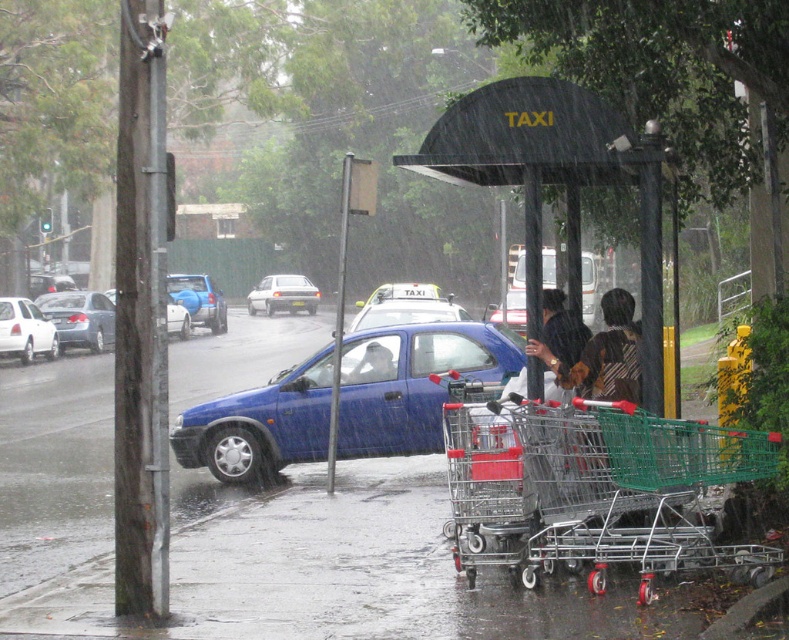
Can you confirm if metallic blue car at center is thinner than blue matte hatchback at center-left?

Correct, metallic blue car at center's width is less than blue matte hatchback at center-left's.

Where is `metallic blue car at center`? Image resolution: width=789 pixels, height=640 pixels. metallic blue car at center is located at coordinates (412, 381).

Does point (499, 380) come behind point (200, 296)?

That is False.

Locate an element on the screen. metallic blue car at center is located at coordinates pos(412,381).

Which is more to the right, black plastic taxi stand at center or matte black sedan at left?

black plastic taxi stand at center

Can you confirm if black plastic taxi stand at center is bigger than matte black sedan at left?

Actually, black plastic taxi stand at center might be smaller than matte black sedan at left.

The height and width of the screenshot is (640, 789). In order to click on black plastic taxi stand at center in this screenshot , I will do `click(554, 173)`.

Can you confirm if metallic blue car at center is positioned above white glossy sedan at left?

Actually, metallic blue car at center is below white glossy sedan at left.

Is point (481, 355) positioned in front of point (9, 300)?

Yes.

Where is `metallic blue car at center`? The height and width of the screenshot is (640, 789). metallic blue car at center is located at coordinates (412, 381).